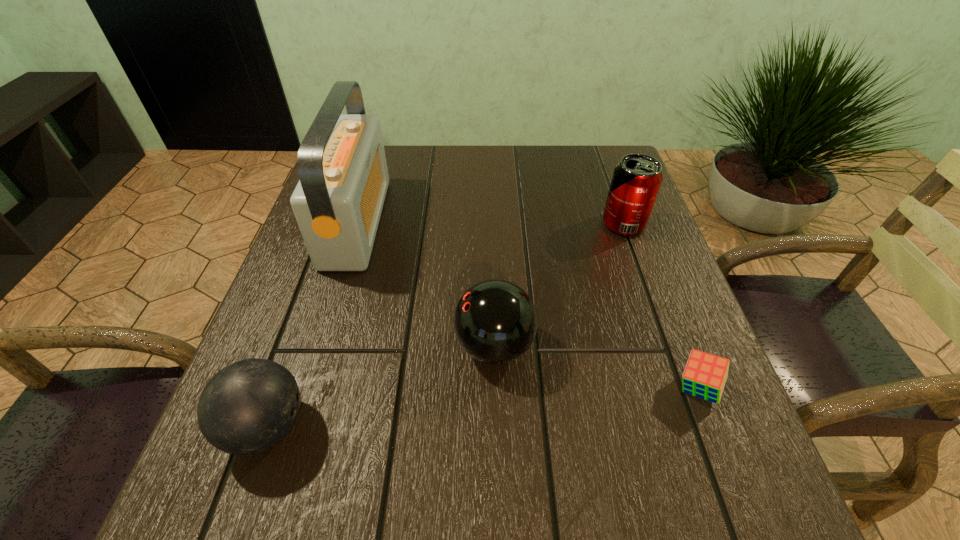
At what (x,y) coordinates should I click in order to perform the action: click on empty space that is in between the cube and the third object from left to right. Please return your answer as a coordinate pair (x, y). This screenshot has width=960, height=540. Looking at the image, I should click on (596, 367).

This screenshot has width=960, height=540. Identify the location of unoccupied area between the cube and the third object from left to right. (596, 367).

Locate an element on the screen. vacant area that lies between the radio receiver and the farther bowling ball is located at coordinates (425, 284).

In order to click on free space between the soda can and the left bowling ball in this screenshot , I will do `click(445, 326)`.

This screenshot has height=540, width=960. Find the location of `free space between the cube and the soda can`. free space between the cube and the soda can is located at coordinates (660, 306).

You are a GUI agent. You are given a task and a screenshot of the screen. Output one action in this format:
    pyautogui.click(x=<x>, y=<y>)
    Task: Click on the unoccupied position between the soda can and the shortest object
    This screenshot has height=540, width=960.
    Given the screenshot: What is the action you would take?
    pyautogui.click(x=660, y=306)

Locate which object is the third closest to the left bowling ball. Please provide its 2D coordinates. Your answer should be formatted as a tuple, i.e. [(x, y)], where the tuple contains the x and y coordinates of a point satisfying the conditions above.

[(705, 375)]

Locate an element on the screen. the second closest object to the shortest object is located at coordinates (636, 180).

The width and height of the screenshot is (960, 540). Find the location of `free point that satisfies the following two spatial constraints: 1. on the front side of the cube; 2. on the left side of the soda can`. free point that satisfies the following two spatial constraints: 1. on the front side of the cube; 2. on the left side of the soda can is located at coordinates [x=682, y=389].

Where is `vacant point that satisfies the following two spatial constraints: 1. on the back side of the soda can; 2. on the front-facing side of the radio receiver`? Image resolution: width=960 pixels, height=540 pixels. vacant point that satisfies the following two spatial constraints: 1. on the back side of the soda can; 2. on the front-facing side of the radio receiver is located at coordinates (623, 222).